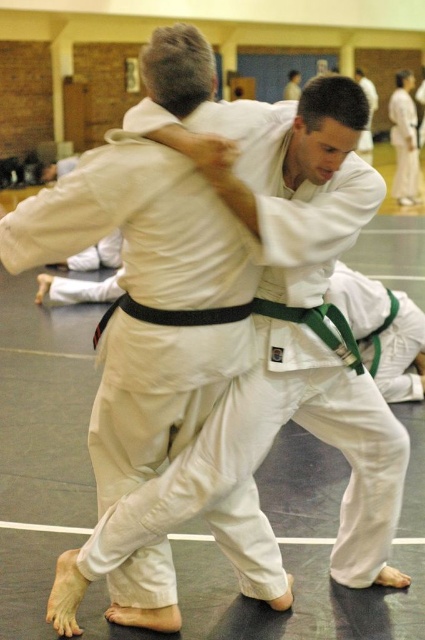
Is green belt at lower right above white karate gi at center?

Actually, green belt at lower right is below white karate gi at center.

Which is behind, point (396, 304) or point (367, 148)?

The point (367, 148) is behind.

The height and width of the screenshot is (640, 425). I want to click on green belt at lower right, so click(382, 332).